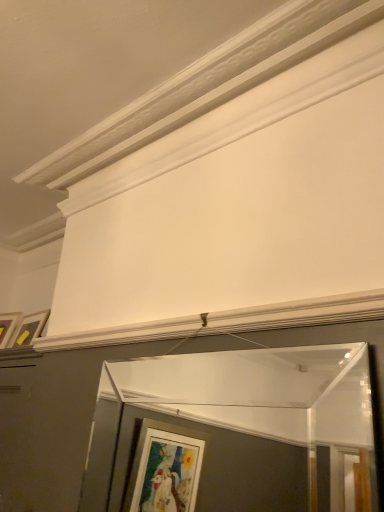
You are a GUI agent. You are given a task and a screenshot of the screen. Output one action in this format:
    pyautogui.click(x=<x>, y=<y>)
    Task: Click on the matte white picture frame at upper left
    The height and width of the screenshot is (512, 384).
    Given the screenshot: What is the action you would take?
    pyautogui.click(x=29, y=329)

What is the approximate width of matte white picture frame at upper left?

The width of matte white picture frame at upper left is 2.30 inches.

Describe the element at coordinates (29, 329) in the screenshot. I see `matte white picture frame at upper left` at that location.

I want to click on clear glass mirror at center, so click(x=235, y=432).

Measure the distance between clear glass mirror at center and camera.

clear glass mirror at center and camera are 3.37 meters apart from each other.

Describe the element at coordinates (235, 432) in the screenshot. I see `clear glass mirror at center` at that location.

Where is `matte white picture frame at upper left`? matte white picture frame at upper left is located at coordinates (29, 329).

Considering the relative positions of matte white picture frame at upper left and clear glass mirror at center in the image provided, is matte white picture frame at upper left to the left of clear glass mirror at center from the viewer's perspective?

Yes.

Considering their positions, is matte white picture frame at upper left located in front of or behind clear glass mirror at center?

In the image, matte white picture frame at upper left appears behind clear glass mirror at center.

Is point (16, 337) more distant than point (149, 444)?

No, (16, 337) is in front of (149, 444).

From the image's perspective, is matte white picture frame at upper left above or below clear glass mirror at center?

matte white picture frame at upper left is above clear glass mirror at center.

From a real-world perspective, is matte white picture frame at upper left physically below clear glass mirror at center?

No.

In terms of width, does matte white picture frame at upper left look wider or thinner when compared to clear glass mirror at center?

In the image, matte white picture frame at upper left appears to be wider than clear glass mirror at center.

Is matte white picture frame at upper left taller or shorter than clear glass mirror at center?

Clearly, matte white picture frame at upper left is shorter compared to clear glass mirror at center.

Based on the photo, considering the sizes of objects matte white picture frame at upper left and clear glass mirror at center in the image provided, who is smaller, matte white picture frame at upper left or clear glass mirror at center?

matte white picture frame at upper left is smaller.

Is matte white picture frame at upper left completely or partially outside of clear glass mirror at center?

Yes, matte white picture frame at upper left is located beyond the bounds of clear glass mirror at center.

Is matte white picture frame at upper left next to clear glass mirror at center and touching it?

Answer: No, matte white picture frame at upper left is not in contact with clear glass mirror at center.

Could you tell me if matte white picture frame at upper left is facing clear glass mirror at center?

No.

You are a GUI agent. You are given a task and a screenshot of the screen. Output one action in this format:
    pyautogui.click(x=<x>, y=<y>)
    Task: Click on the window frame lying in front of the matte white picture frame at upper left
    The image size is (384, 512).
    Given the screenshot: What is the action you would take?
    pyautogui.click(x=235, y=432)

Between clear glass mirror at center and matte white picture frame at upper left, which one appears on the left side from the viewer's perspective?

matte white picture frame at upper left.

Is the position of clear glass mirror at center more distant than that of matte white picture frame at upper left?

No.

Which is in front, point (377, 506) or point (39, 326)?

The point (377, 506) is closer to the camera.

From the image's perspective, between clear glass mirror at center and matte white picture frame at upper left, which one is located above?

From the image's view, matte white picture frame at upper left is above.

From the picture: From a real-world perspective, who is located higher, clear glass mirror at center or matte white picture frame at upper left?

matte white picture frame at upper left, from a real-world perspective.

In the scene shown: Is clear glass mirror at center thinner than matte white picture frame at upper left?

Indeed, clear glass mirror at center has a lesser width compared to matte white picture frame at upper left.

Considering the sizes of clear glass mirror at center and matte white picture frame at upper left in the image, is clear glass mirror at center taller or shorter than matte white picture frame at upper left?

Considering their sizes, clear glass mirror at center has more height than matte white picture frame at upper left.

Who is bigger, clear glass mirror at center or matte white picture frame at upper left?

clear glass mirror at center is bigger.

Based on the photo, is matte white picture frame at upper left completely or partially inside clear glass mirror at center?

Definitely not — matte white picture frame at upper left is not inside clear glass mirror at center.

Is clear glass mirror at center in contact with matte white picture frame at upper left?

No, clear glass mirror at center is not next to matte white picture frame at upper left.

Is clear glass mirror at center oriented towards matte white picture frame at upper left?

No.

Measure the distance between clear glass mirror at center and matte white picture frame at upper left.

They are 2.51 meters apart.

You are a GUI agent. You are given a task and a screenshot of the screen. Output one action in this format:
    pyautogui.click(x=<x>, y=<y>)
    Task: Click on the window frame that appears below the matte white picture frame at upper left (from a real-world perspective)
    
    Given the screenshot: What is the action you would take?
    pyautogui.click(x=235, y=432)

At what (x,y) coordinates should I click in order to perform the action: click on window frame on the right side of matte white picture frame at upper left. Please return your answer as a coordinate pair (x, y). The height and width of the screenshot is (512, 384). Looking at the image, I should click on (235, 432).

Where is `picture frame lying behind the clear glass mirror at center`? picture frame lying behind the clear glass mirror at center is located at coordinates (29, 329).